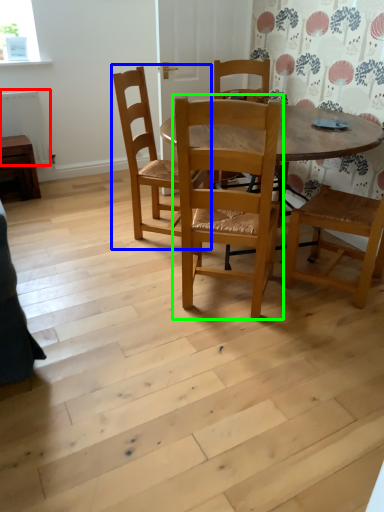
Question: Which object is the closest to the radiator (highlighted by a red box)? Choose among these: chair (highlighted by a blue box) or chair (highlighted by a green box).

Choices:
 (A) chair
 (B) chair

Answer: (A)